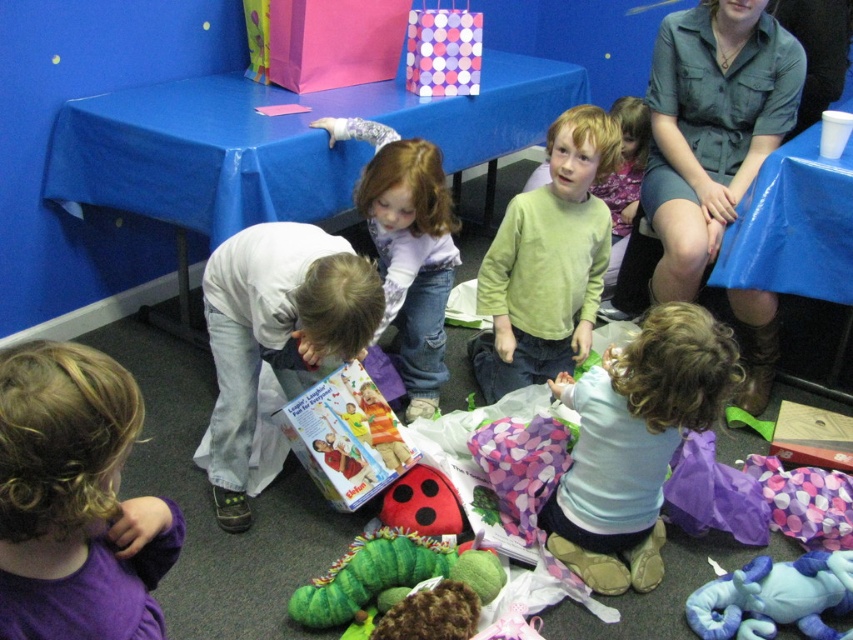
Is point (711, 420) positioned in front of point (585, 346)?

Yes, it is in front of point (585, 346).

Which is in front, point (619, 588) or point (537, 211)?

Point (619, 588) is in front.

Does point (619, 545) lie behind point (489, 396)?

No.

Find the location of a particular element. light blue fabric at center is located at coordinates (634, 442).

From the picture: Does light blue fabric at center lie behind blue plush elephant at lower right?

No, it is not.

Is light blue fabric at center wider than blue plush elephant at lower right?

Indeed, light blue fabric at center has a greater width compared to blue plush elephant at lower right.

Is point (645, 572) positioned before point (685, 612)?

No, it is behind (685, 612).

This screenshot has width=853, height=640. I want to click on light blue fabric at center, so click(x=634, y=442).

Is purple fleece shirt at lower left smaller than light brown hair at center?

Yes, purple fleece shirt at lower left is smaller than light brown hair at center.

In the scene shown: Does purple fleece shirt at lower left have a lesser width compared to light brown hair at center?

Indeed, purple fleece shirt at lower left has a lesser width compared to light brown hair at center.

Where is `purple fleece shirt at lower left`? Image resolution: width=853 pixels, height=640 pixels. purple fleece shirt at lower left is located at coordinates (74, 500).